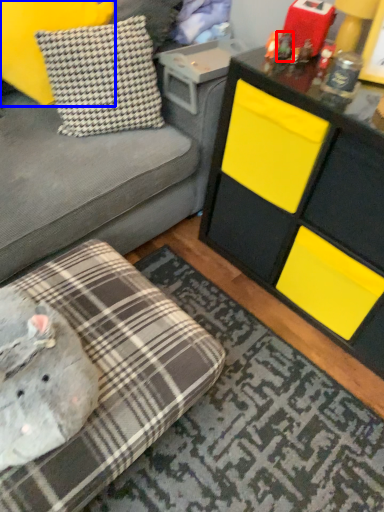
Question: Which of the following is the closest to the observer, toy (highlighted by a red box) or pillow (highlighted by a blue box)?

Choices:
 (A) toy
 (B) pillow

Answer: (B)